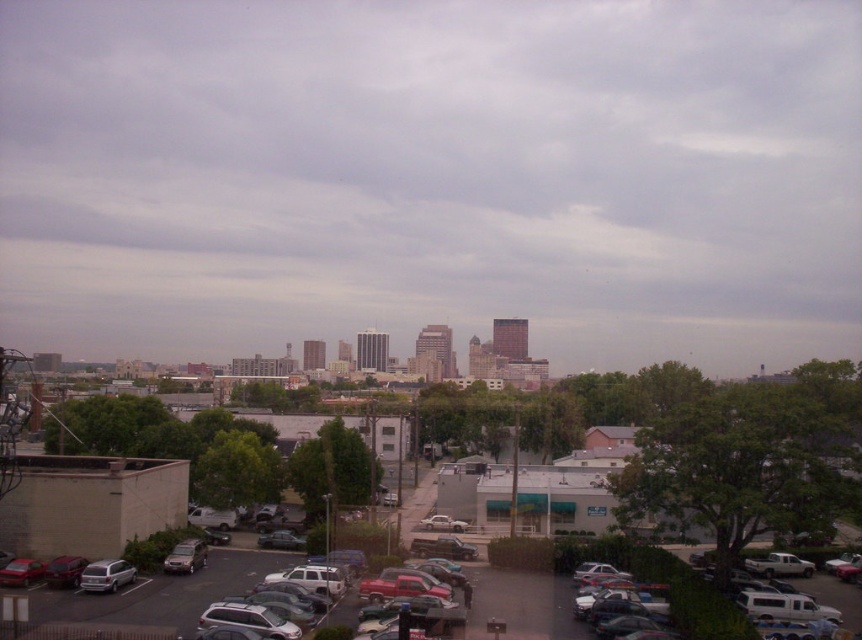
Question: Does metallic silver cars at lower center have a lesser width compared to matte silver sedan at lower right?

Choices:
 (A) yes
 (B) no

Answer: (B)

Question: Which object is closer to the camera taking this photo?

Choices:
 (A) matte silver sedan at lower right
 (B) metallic silver sedan at center
 (C) silver metallic van at lower left
 (D) matte silver sedan at lower left

Answer: (A)

Question: Can you confirm if silver metallic van at lower left is positioned to the right of matte silver sedan at lower left?

Choices:
 (A) no
 (B) yes

Answer: (A)

Question: Which object is positioned closest to the metallic silver cars at lower center?

Choices:
 (A) matte silver sedan at lower left
 (B) metallic silver sedan at center
 (C) matte silver sedan at lower right
 (D) silver metallic van at lower left

Answer: (C)

Question: Which object is farther from the camera taking this photo?

Choices:
 (A) metallic silver sedan at center
 (B) silver metallic van at lower left
 (C) matte silver sedan at lower left

Answer: (A)

Question: Can you confirm if matte silver sedan at lower right is thinner than matte silver sedan at lower left?

Choices:
 (A) yes
 (B) no

Answer: (B)